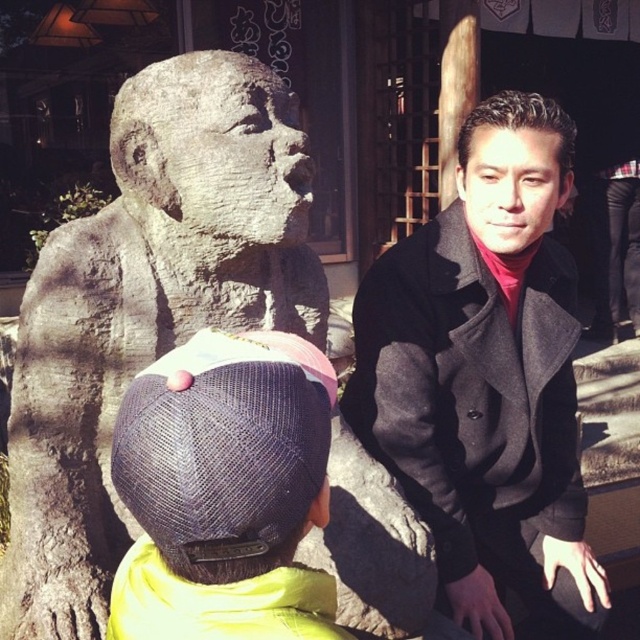
You are a delivery robot that is 12 inches wide. You are in the scene and need to move from the gray stone statue at center to the denim cap at lower left. Can you pass through the space between them without any obstacles?

The distance between the gray stone statue at center and the denim cap at lower left is 23.29 inches. Since the robot is 12 inches wide, there is enough space to pass through the 23.29 inches gap between them.

You are standing at the center of the image. Which direction should you move to reach the gray stone statue at center?

The gray stone statue at center is already at your current position since you are both at point (147, 308).

You are a tailor who needs to determine which item requires more fabric to make between the dark gray wool coat at right and the denim cap at lower left. Based on their sizes, which one would need more fabric?

The dark gray wool coat at right requires more fabric than the denim cap at lower left because its width is larger, indicating it is bigger in size.